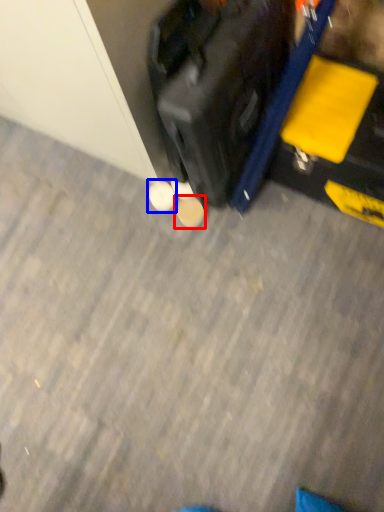
Question: Which of the following is the closest to the observer, footwear (highlighted by a red box) or footwear (highlighted by a blue box)?

Choices:
 (A) footwear
 (B) footwear

Answer: (A)